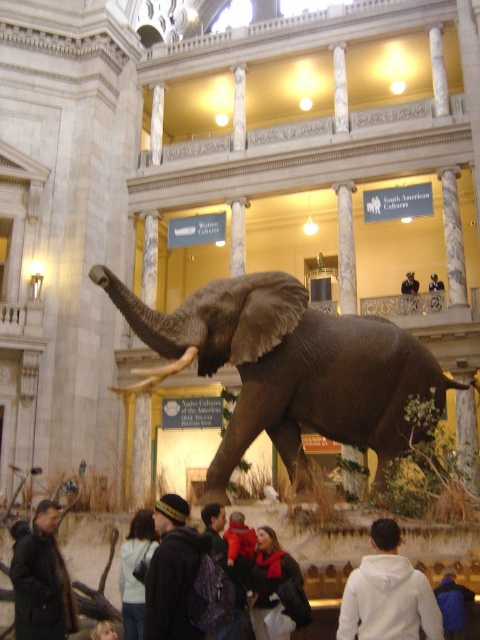
Question: Does dark brown leather jacket at lower left appear on the right side of blue fuzzy jacket at lower right?

Choices:
 (A) no
 (B) yes

Answer: (A)

Question: Which point is closer to the camera?

Choices:
 (A) (375, 632)
 (B) (414, 280)
 (C) (269, 588)

Answer: (A)

Question: Which point is farther to the camera?

Choices:
 (A) dark brown leather jacket at center
 (B) smooth black jacket at center
 (C) white fleece jacket at lower center
 (D) dark gray hoodie at center

Answer: (B)

Question: Is the position of dark brown leather jacket at center less distant than that of smooth black jacket at center?

Choices:
 (A) yes
 (B) no

Answer: (A)

Question: Which of the following is the farthest from the observer?

Choices:
 (A) white fleece jacket at lower center
 (B) light brown leather jacket at lower center
 (C) dark brown leather jacket at lower left

Answer: (B)

Question: Does light brown leather jacket at lower center have a greater width compared to dark blue jeans at center?

Choices:
 (A) yes
 (B) no

Answer: (B)